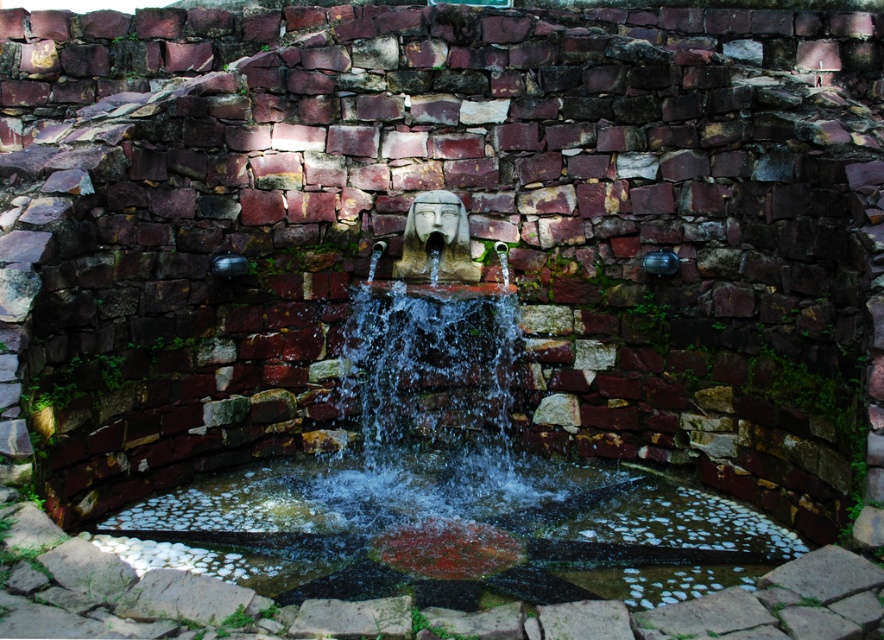
Question: Can you confirm if stone fountain at center is smaller than clear water at center?

Choices:
 (A) yes
 (B) no

Answer: (B)

Question: Does stone fountain at center appear on the right side of clear water at center?

Choices:
 (A) yes
 (B) no

Answer: (A)

Question: Among these points, which one is nearest to the camera?

Choices:
 (A) (334, 460)
 (B) (364, 480)

Answer: (B)

Question: Does stone fountain at center have a lesser width compared to clear water at center?

Choices:
 (A) no
 (B) yes

Answer: (B)

Question: Among these points, which one is farthest from the camera?

Choices:
 (A) (250, 529)
 (B) (732, 582)

Answer: (A)